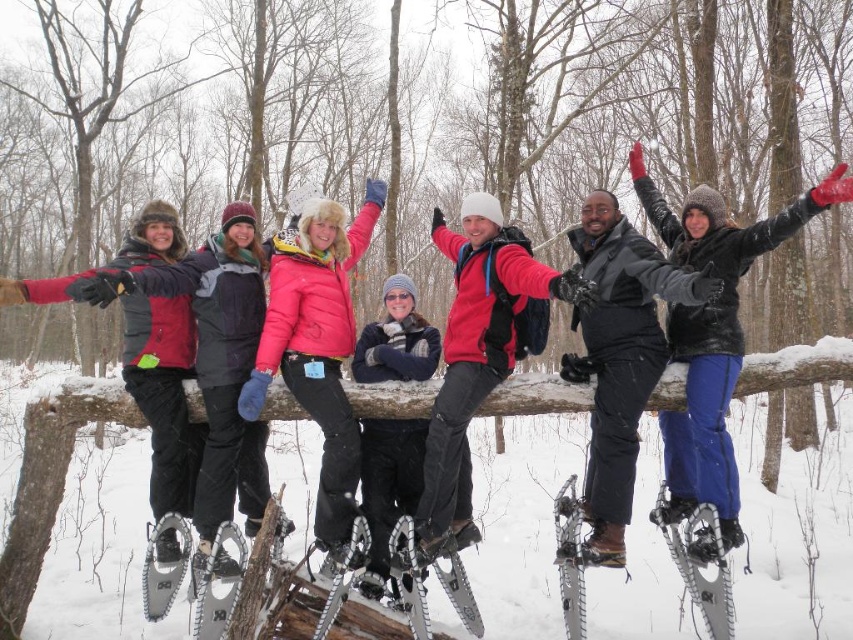
Can you confirm if white fluffy snow at center is positioned below pink matte jacket at center?

Yes.

This screenshot has height=640, width=853. Describe the element at coordinates (74, 528) in the screenshot. I see `white fluffy snow at center` at that location.

Who is more distant from viewer, (494, 586) or (293, 394)?

The point (494, 586) is behind.

Where is `white fluffy snow at center`? The height and width of the screenshot is (640, 853). white fluffy snow at center is located at coordinates (74, 528).

Is white fluffy snow at center bigger than matte red jacket at center?

Yes.

Is white fluffy snow at center to the right of matte red jacket at center from the viewer's perspective?

Yes, white fluffy snow at center is to the right of matte red jacket at center.

Is point (519, 456) closer to viewer compared to point (579, 296)?

No, (519, 456) is behind (579, 296).

I want to click on white fluffy snow at center, so click(74, 528).

Who is higher up, white fluffy snow at center or black matte snowshoes at center?

black matte snowshoes at center

Which is more to the right, white fluffy snow at center or black matte snowshoes at center?

Positioned to the right is black matte snowshoes at center.

Is point (135, 497) positioned after point (590, 266)?

Yes.

Identify the location of white fluffy snow at center. This screenshot has width=853, height=640. (74, 528).